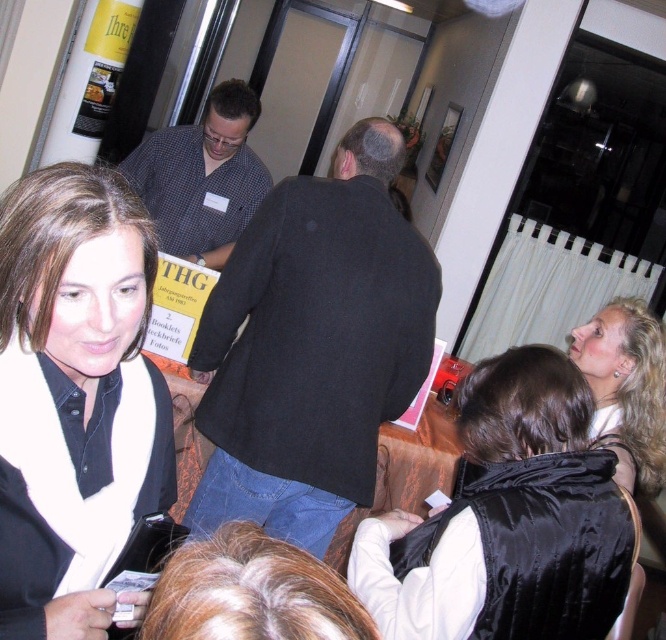
Question: From the image, what is the correct spatial relationship of black satin vest at lower right in relation to checkered fabric shirt at center?

Choices:
 (A) below
 (B) above

Answer: (A)

Question: Does matte black scarf at lower left appear on the right side of checkered fabric shirt at center?

Choices:
 (A) no
 (B) yes

Answer: (B)

Question: Which of the following is the closest to the observer?

Choices:
 (A) (316, 499)
 (B) (57, 435)

Answer: (B)

Question: Is black wool coat at center behind matte black scarf at lower left?

Choices:
 (A) yes
 (B) no

Answer: (A)

Question: Which object appears closest to the camera in this image?

Choices:
 (A) blonde hair at upper right
 (B) checkered fabric shirt at center
 (C) black wool coat at center
 (D) matte black scarf at lower left

Answer: (D)

Question: Based on their relative distances, which object is farther from the black satin vest at lower right?

Choices:
 (A) blonde hair at upper right
 (B) checkered fabric shirt at center

Answer: (B)